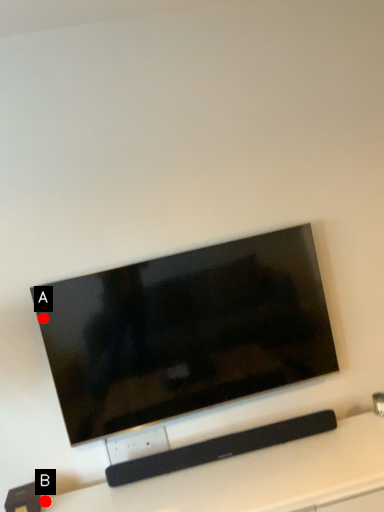
Question: Two points are circled on the image, labeled by A and B beside each circle. Among these points, which one is nearest to the camera?

Choices:
 (A) A is closer
 (B) B is closer

Answer: (A)